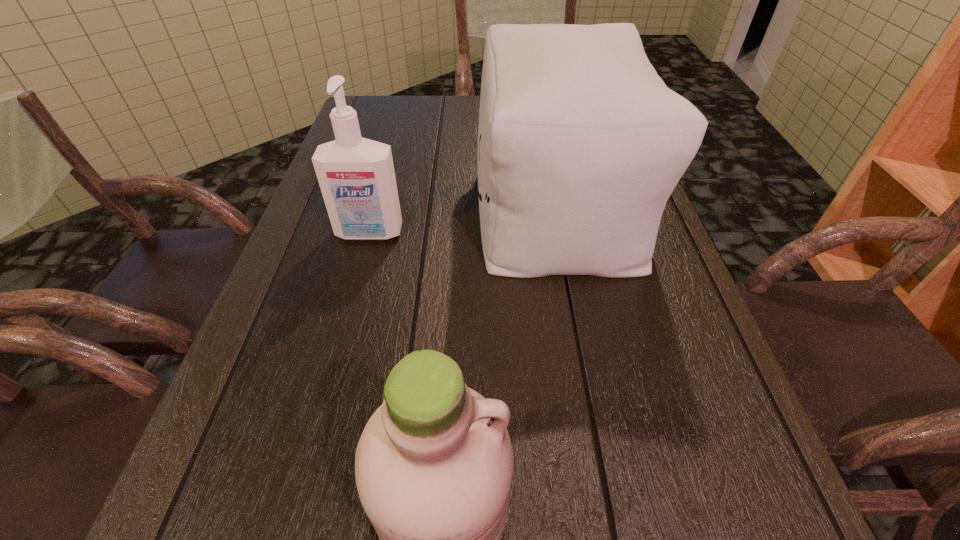
This screenshot has height=540, width=960. In order to click on cushion in this screenshot , I will do `click(580, 143)`.

The image size is (960, 540). I want to click on the leftmost object, so click(356, 175).

This screenshot has height=540, width=960. Identify the location of the left cleansing agent. (356, 175).

The height and width of the screenshot is (540, 960). In order to click on free space located 0.320m on the side of the cushion with the smiley face in this screenshot , I will do `click(341, 205)`.

Locate an element on the screen. The height and width of the screenshot is (540, 960). vacant region located on the side of the cushion with the smiley face is located at coordinates (435, 205).

Where is `free space located on the side of the cushion with the smiley face`? free space located on the side of the cushion with the smiley face is located at coordinates (414, 205).

Find the location of a particular element. This screenshot has width=960, height=540. vacant space located 0.280m on the front label of the left cleansing agent is located at coordinates (336, 359).

Find the location of a particular element. The height and width of the screenshot is (540, 960). object that is at the left edge is located at coordinates (356, 175).

At what (x,y) coordinates should I click in order to perform the action: click on object that is positioned at the right edge. Please return your answer as a coordinate pair (x, y). Looking at the image, I should click on (580, 143).

What are the coordinates of `vacant space at the left edge of the desktop` in the screenshot? It's located at (300, 391).